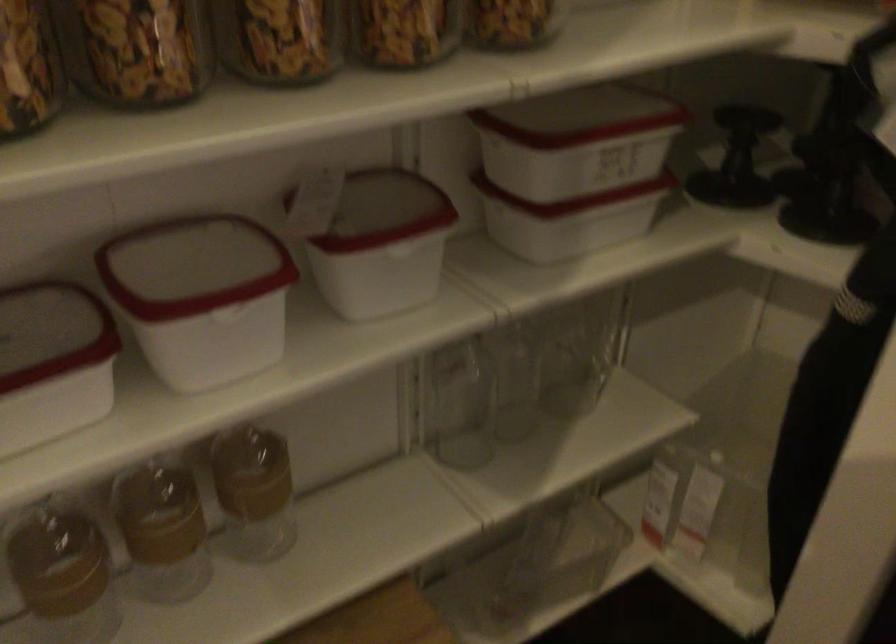
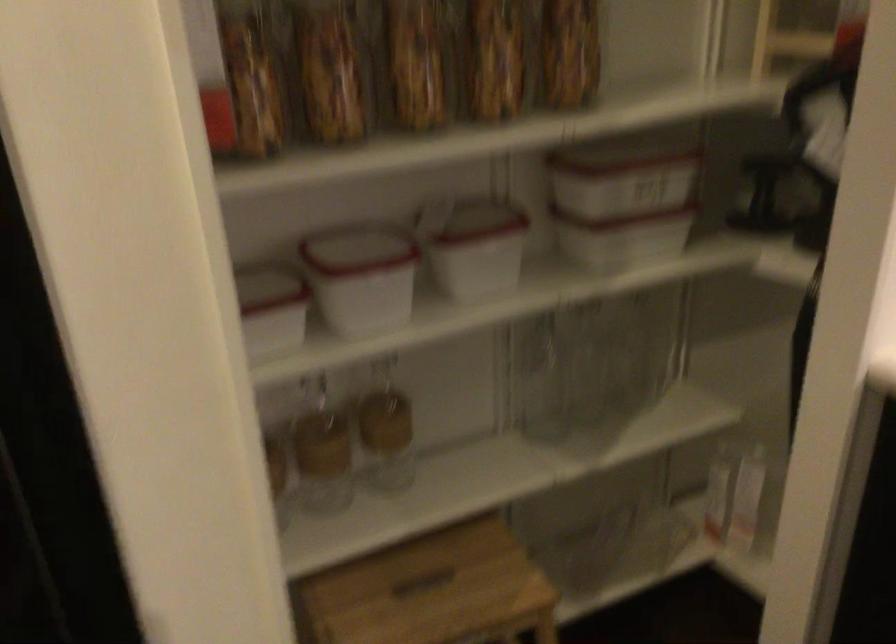
Where in the second image is the point corresponding to the point at 580,176 from the first image?

(622, 204)